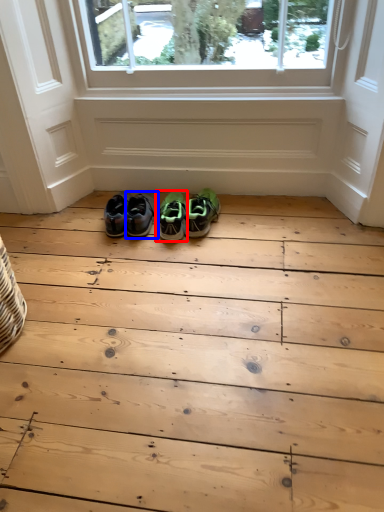
Question: Which of the following is the farthest to the observer, footwear (highlighted by a red box) or footwear (highlighted by a blue box)?

Choices:
 (A) footwear
 (B) footwear

Answer: (B)